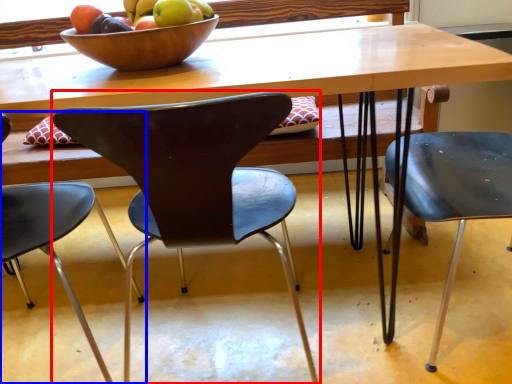
Question: Among these objects, which one is nearest to the camera, chair (highlighted by a red box) or chair (highlighted by a blue box)?

Choices:
 (A) chair
 (B) chair

Answer: (B)